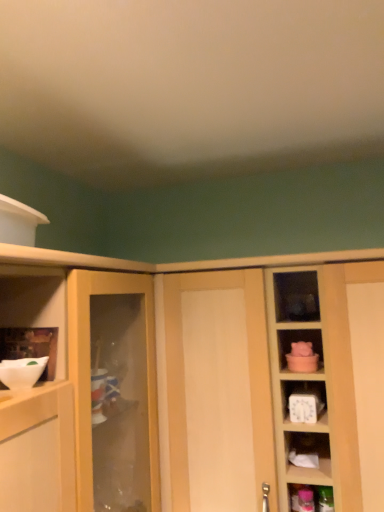
Describe the element at coordinates (182, 332) in the screenshot. I see `light wood cabinet at center` at that location.

Measure the distance between white glossy bowl at left and camera.

white glossy bowl at left is 31.97 inches from camera.

Find the location of a particular element. light wood cabinet at center is located at coordinates (182, 332).

Is light wood cabinet at center facing away from white glossy bowl at left?

No, light wood cabinet at center is not facing away from white glossy bowl at left.

Does light wood cabinet at center have a lesser width compared to white glossy bowl at left?

No.

Can you confirm if light wood cabinet at center is smaller than white glossy bowl at left?

No, light wood cabinet at center is not smaller than white glossy bowl at left.

Which is in front, light wood cabinet at center or white glossy bowl at left?

white glossy bowl at left is more forward.

Is the surface of white matte mixing bowl at left in direct contact with white glossy bowl at left?

Indeed, white matte mixing bowl at left and white glossy bowl at left are beside each other and touching.

Would you say white matte mixing bowl at left is to the left or to the right of white glossy bowl at left in the picture?

From the image, it's evident that white matte mixing bowl at left is to the right of white glossy bowl at left.

From the image's perspective, is white matte mixing bowl at left beneath white glossy bowl at left?

Correct, white matte mixing bowl at left appears lower than white glossy bowl at left in the image.

In terms of height, does white matte mixing bowl at left look taller or shorter compared to white glossy bowl at left?

Clearly, white matte mixing bowl at left is shorter compared to white glossy bowl at left.

How many degrees apart are the facing directions of white glossy bowl at left and light wood cabinet at center?

The angular difference between white glossy bowl at left and light wood cabinet at center is 0.0118 degrees.

Is white glossy bowl at left smaller than light wood cabinet at center?

Yes, white glossy bowl at left is smaller than light wood cabinet at center.

In the image, is white glossy bowl at left positioned in front of or behind light wood cabinet at center?

Visually, white glossy bowl at left is located in front of light wood cabinet at center.

From the image's perspective, which one is positioned higher, white glossy bowl at left or light wood cabinet at center?

white glossy bowl at left.

Which of these two, white glossy bowl at left or white matte mixing bowl at left, stands shorter?

With less height is white matte mixing bowl at left.

From a real-world perspective, which is physically below, white glossy bowl at left or white matte mixing bowl at left?

In real-world perspective, white matte mixing bowl at left is lower.

How different are the orientations of white glossy bowl at left and white matte mixing bowl at left in degrees?

There is a 34.4-degree angle between the facing directions of white glossy bowl at left and white matte mixing bowl at left.

Identify the location of shelf that is above the white matte mixing bowl at left (from a real-world perspective). (30, 346).

From the image's perspective, is light wood cabinet at center located above white matte mixing bowl at left?

No, from the image's perspective, light wood cabinet at center is not on top of white matte mixing bowl at left.

Which of these two, light wood cabinet at center or white matte mixing bowl at left, is smaller?

With smaller size is white matte mixing bowl at left.

Measure the distance from light wood cabinet at center to white matte mixing bowl at left.

light wood cabinet at center and white matte mixing bowl at left are 19.39 inches apart from each other.

Considering the sizes of light wood cabinet at center and white matte mixing bowl at left in the image, is light wood cabinet at center taller or shorter than white matte mixing bowl at left?

light wood cabinet at center is taller than white matte mixing bowl at left.

Between white matte mixing bowl at left and light wood cabinet at center, which one has less height?

white matte mixing bowl at left is shorter.

Is white matte mixing bowl at left to the right of light wood cabinet at center from the viewer's perspective?

No.

From a real-world perspective, relative to light wood cabinet at center, is white matte mixing bowl at left vertically above or below?

In terms of real-world spatial position, white matte mixing bowl at left is above light wood cabinet at center.

Considering their positions, is white matte mixing bowl at left located in front of or behind light wood cabinet at center?

Visually, white matte mixing bowl at left is located in front of light wood cabinet at center.

Find the location of `cabinetry that appears on the right of white glossy bowl at left`. cabinetry that appears on the right of white glossy bowl at left is located at coordinates (182, 332).

You are a GUI agent. You are given a task and a screenshot of the screen. Output one action in this format:
    pyautogui.click(x=<x>, y=<y>)
    Task: Click on the shelf above the white matte mixing bowl at left (from the image's perspective)
    The height and width of the screenshot is (512, 384).
    Given the screenshot: What is the action you would take?
    pyautogui.click(x=30, y=346)

From the image, which object appears to be farther from white glossy bowl at left, light wood cabinet at center or white matte mixing bowl at left?

light wood cabinet at center is further to white glossy bowl at left.

Which object lies nearer to the anchor point white matte mixing bowl at left, white glossy bowl at left or light wood cabinet at center?

white glossy bowl at left lies closer to white matte mixing bowl at left than the other object.

Looking at the image, which one is located closer to light wood cabinet at center, white glossy bowl at left or white matte mixing bowl at left?

white glossy bowl at left lies closer to light wood cabinet at center than the other object.

Looking at the image, which one is located further to white matte mixing bowl at left, light wood cabinet at center or white glossy bowl at left?

light wood cabinet at center is further to white matte mixing bowl at left.

Looking at the image, which one is located closer to light wood cabinet at center, white matte mixing bowl at left or white glossy bowl at left?

The object closer to light wood cabinet at center is white glossy bowl at left.

Looking at the image, which one is located closer to white glossy bowl at left, white matte mixing bowl at left or light wood cabinet at center?

white matte mixing bowl at left is positioned closer to the anchor white glossy bowl at left.

Where is `mixing bowl between white glossy bowl at left and light wood cabinet at center`? The image size is (384, 512). mixing bowl between white glossy bowl at left and light wood cabinet at center is located at coordinates (22, 372).